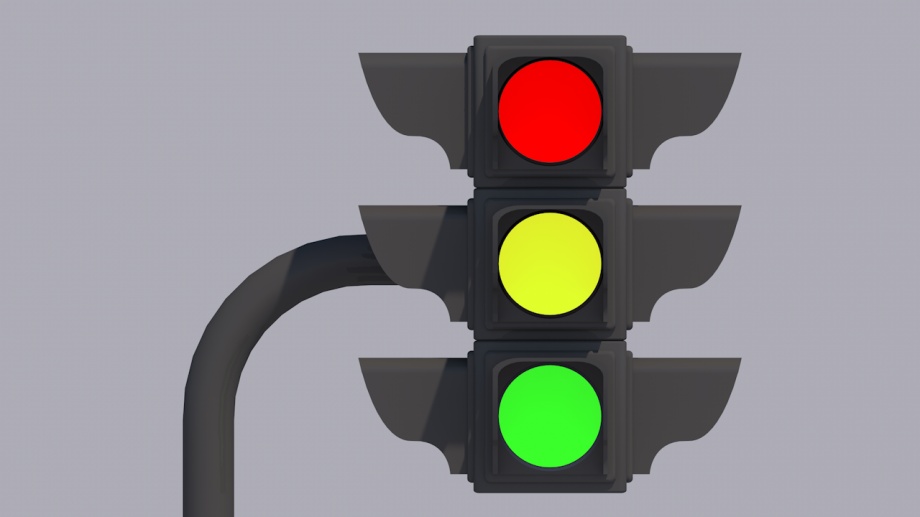
Find the location of a particular element. yellow light is located at coordinates (558, 273).